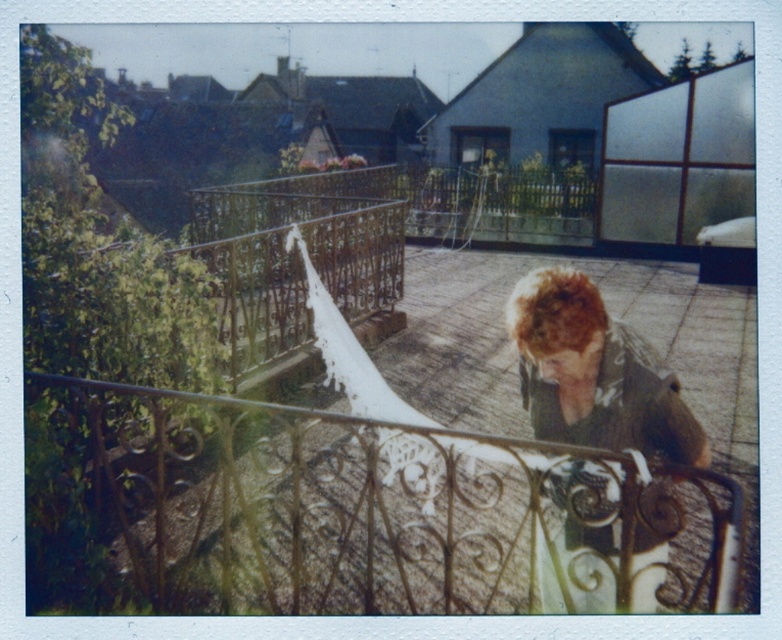
You are standing at the bottom of the stairs and looking up at the scene. Which object is closer to your eyes, the wrought iron fence at center or the shaggy brown hair at center?

The wrought iron fence at center is positioned under the shaggy brown hair at center, so the shaggy brown hair at center is closer to your eyes.

You are a painter standing at the bottom of the stairs. You want to paint the wrought iron fence at center and the shaggy brown hair at center. Which object should you move closer to first to ensure you can paint both without moving your easel?

The wrought iron fence at center is bigger than the shaggy brown hair at center, so you should move closer to the wrought iron fence at center first to capture its details while still keeping the shaggy brown hair at center in view.